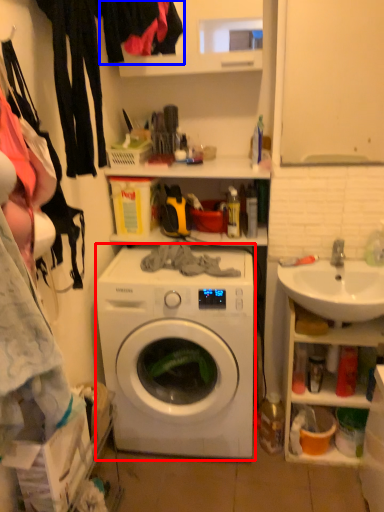
Question: Which of the following is the farthest to the observer, washing machine (highlighted by a red box) or clothing (highlighted by a blue box)?

Choices:
 (A) washing machine
 (B) clothing

Answer: (A)